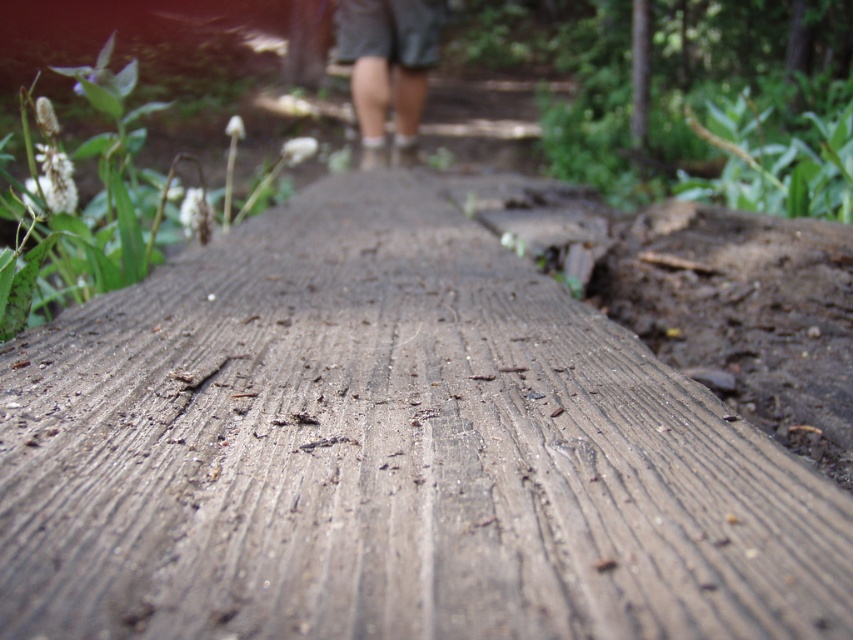
Question: Considering the relative positions of weathered wood at center and dark green shorts at center in the image provided, where is weathered wood at center located with respect to dark green shorts at center?

Choices:
 (A) below
 (B) above

Answer: (A)

Question: Does weathered wood at center appear under dark green shorts at center?

Choices:
 (A) no
 (B) yes

Answer: (B)

Question: Among these points, which one is farthest from the camera?

Choices:
 (A) (466, 456)
 (B) (361, 35)

Answer: (B)

Question: Is weathered wood at center bigger than dark green shorts at center?

Choices:
 (A) no
 (B) yes

Answer: (A)